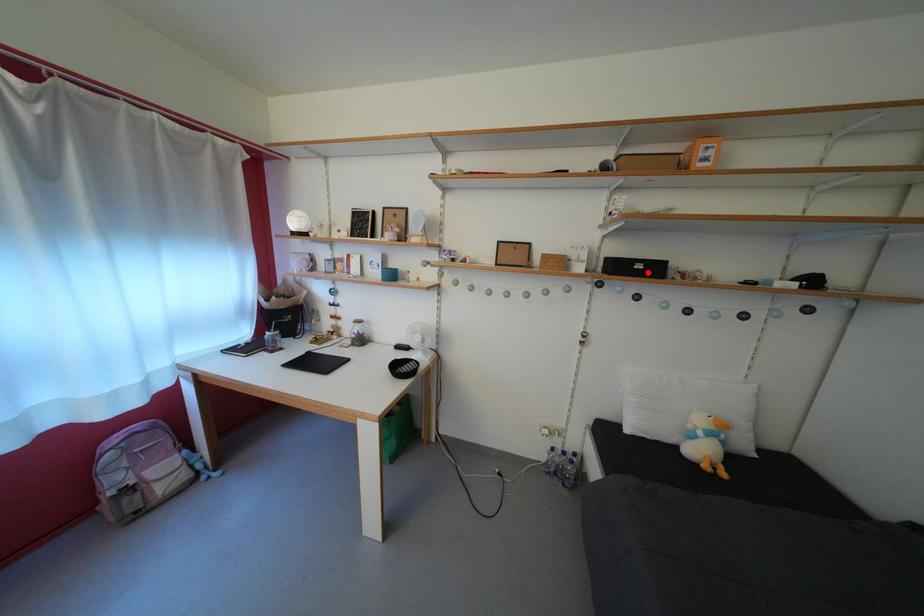
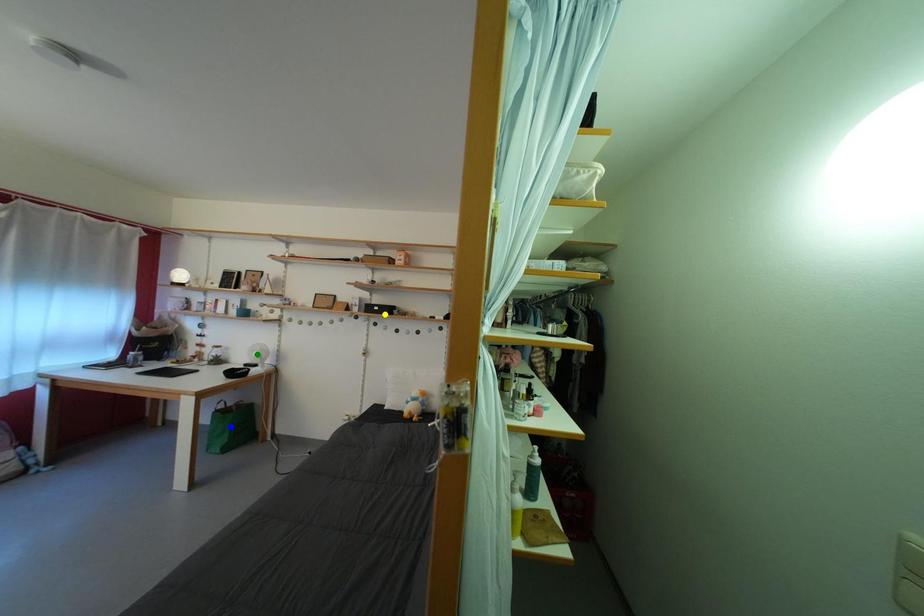
Question: I am providing you with two images of the same scene from different viewpoints. A red point is marked on the first image. You are given multiple points on the second image. In image 2, which mark is for the same physical point as the one in image 1?

Choices:
 (A) blue point
 (B) green point
 (C) yellow point

Answer: (C)